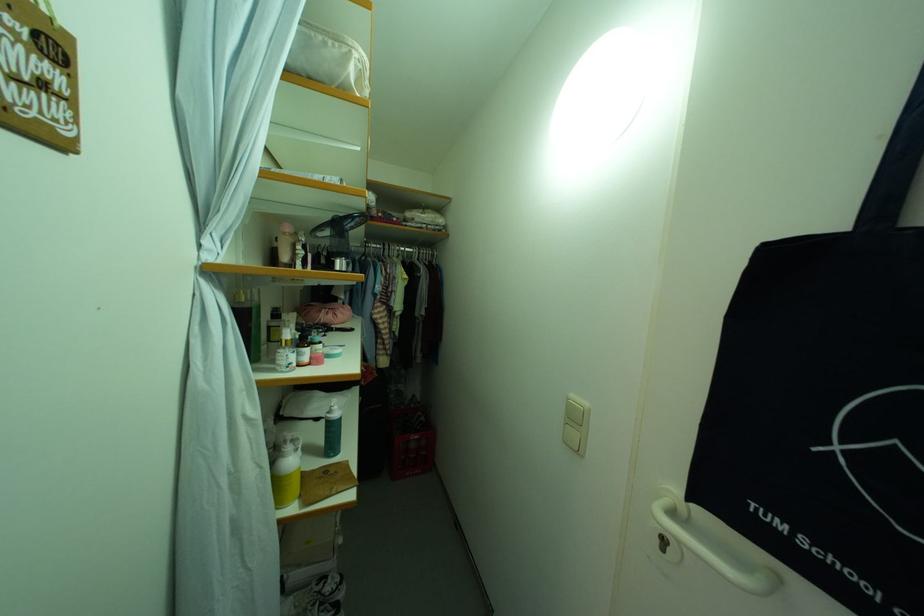
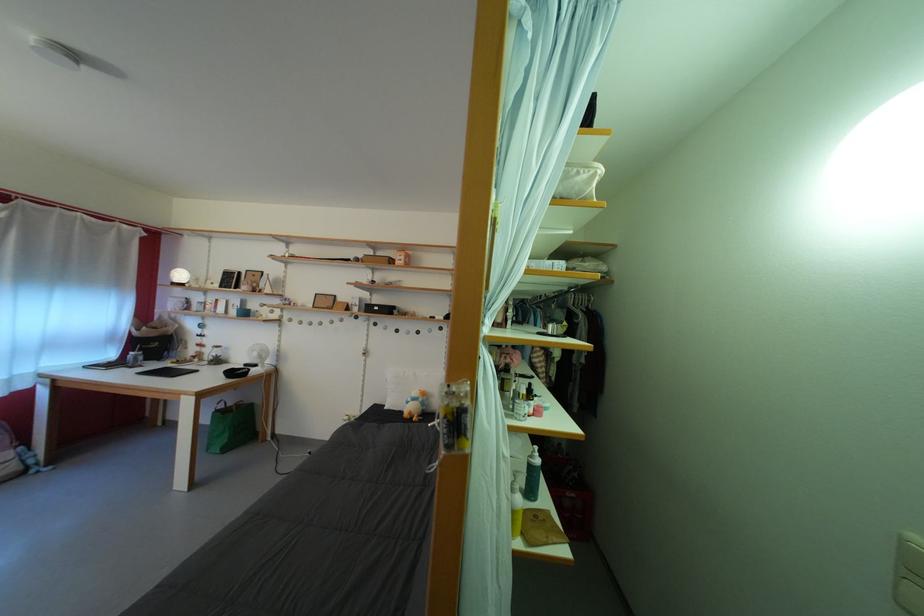
Locate, in the second image, the point that corresponds to the point at 337,418 in the first image.

(540, 463)